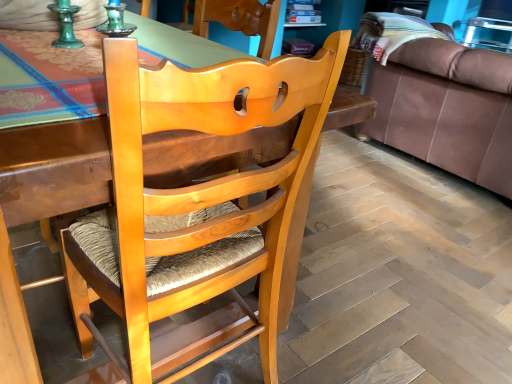
Question: Considering the relative positions of brown leather couch at right and light brown wood chair at center in the image provided, is brown leather couch at right to the left of light brown wood chair at center from the viewer's perspective?

Choices:
 (A) no
 (B) yes

Answer: (A)

Question: Is brown leather couch at right surrounding light brown wood chair at center?

Choices:
 (A) no
 (B) yes

Answer: (A)

Question: Can you confirm if brown leather couch at right is shorter than light brown wood chair at center?

Choices:
 (A) yes
 (B) no

Answer: (A)

Question: From a real-world perspective, is brown leather couch at right below light brown wood chair at center?

Choices:
 (A) yes
 (B) no

Answer: (A)

Question: Is brown leather couch at right to the right of light brown wood chair at center from the viewer's perspective?

Choices:
 (A) yes
 (B) no

Answer: (A)

Question: Is brown leather couch at right aimed at light brown wood chair at center?

Choices:
 (A) yes
 (B) no

Answer: (B)

Question: Is light brown wood chair at center bigger than brown leather couch at right?

Choices:
 (A) no
 (B) yes

Answer: (A)

Question: Is light brown wood chair at center at the left side of brown leather couch at right?

Choices:
 (A) no
 (B) yes

Answer: (B)

Question: Can you confirm if light brown wood chair at center is wider than brown leather couch at right?

Choices:
 (A) no
 (B) yes

Answer: (A)

Question: From the image's perspective, would you say light brown wood chair at center is shown under brown leather couch at right?

Choices:
 (A) no
 (B) yes

Answer: (B)

Question: Is light brown wood chair at center not inside brown leather couch at right?

Choices:
 (A) no
 (B) yes

Answer: (B)

Question: From a real-world perspective, is light brown wood chair at center over brown leather couch at right?

Choices:
 (A) yes
 (B) no

Answer: (A)

Question: Based on their sizes in the image, would you say brown leather couch at right is bigger or smaller than light brown wood chair at center?

Choices:
 (A) big
 (B) small

Answer: (A)